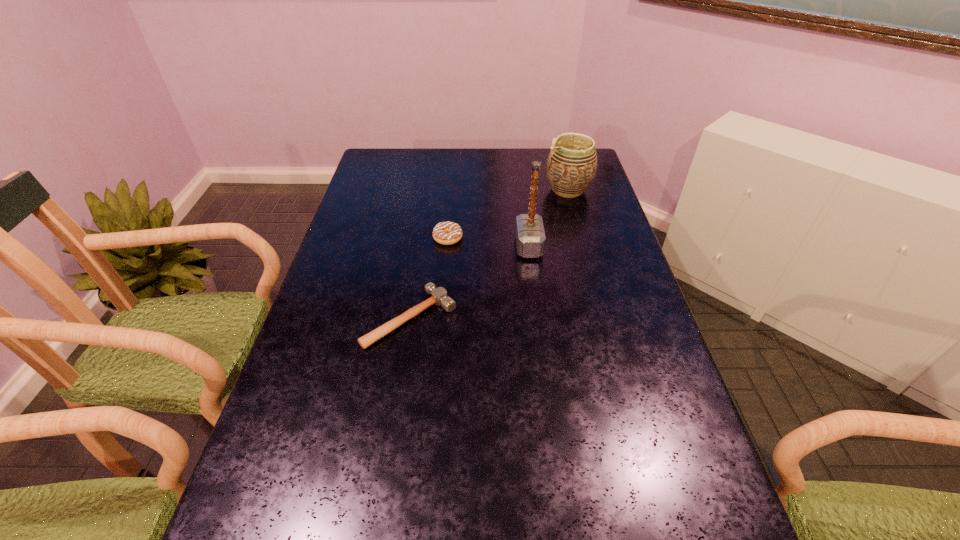
Where is `the tallest object`? This screenshot has width=960, height=540. the tallest object is located at coordinates click(530, 236).

I want to click on the right hammer, so click(x=530, y=236).

Image resolution: width=960 pixels, height=540 pixels. I want to click on the rightmost object, so click(x=571, y=166).

At what (x,y) coordinates should I click in order to perform the action: click on the farthest object. Please return your answer as a coordinate pair (x, y). Looking at the image, I should click on (571, 166).

Locate an element on the screen. doughnut is located at coordinates (447, 233).

I want to click on the shorter hammer, so click(439, 296).

Image resolution: width=960 pixels, height=540 pixels. I want to click on the left hammer, so click(439, 296).

You are a GUI agent. You are given a task and a screenshot of the screen. Output one action in this format:
    pyautogui.click(x=<x>, y=<y>)
    Task: Click on the free space located on the striking surface of the taller hammer
    This screenshot has height=540, width=960.
    Given the screenshot: What is the action you would take?
    pyautogui.click(x=384, y=246)

Image resolution: width=960 pixels, height=540 pixels. Identify the location of vacant region located on the striking surface of the taller hammer. (437, 246).

You are a GUI agent. You are given a task and a screenshot of the screen. Output one action in this format:
    pyautogui.click(x=<x>, y=<y>)
    Task: Click on the free space located on the striking surface of the taller hammer
    This screenshot has width=960, height=540.
    Given the screenshot: What is the action you would take?
    pyautogui.click(x=411, y=246)